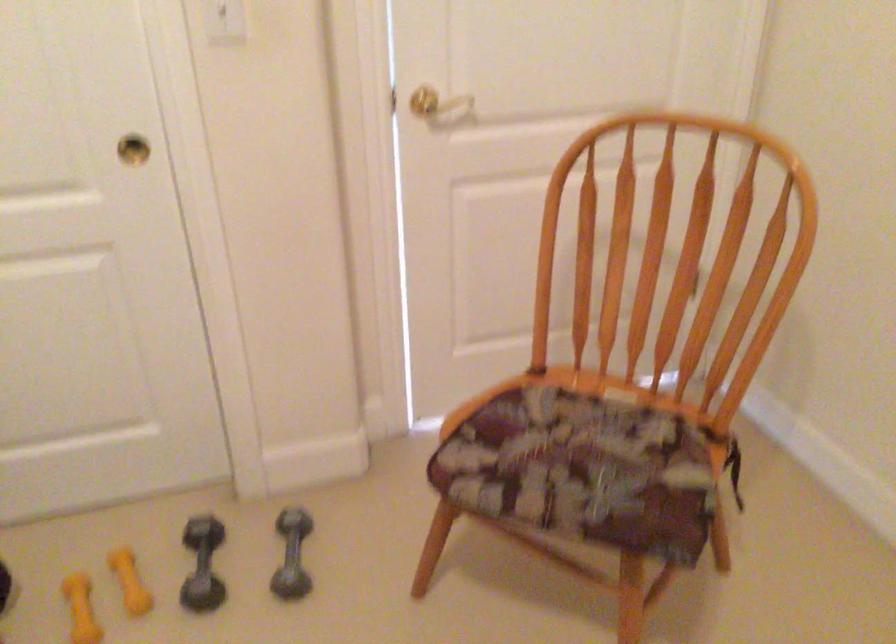
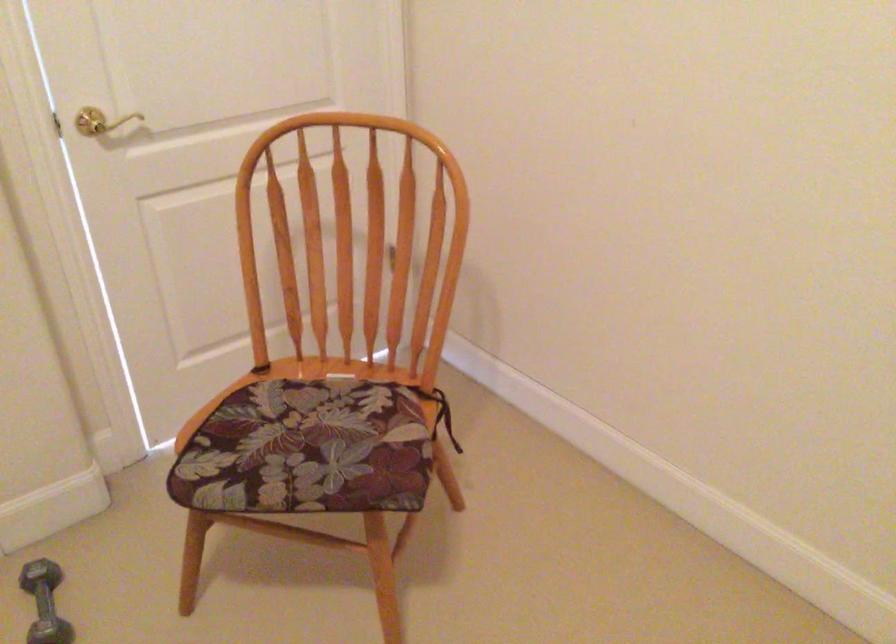
Question: The images are taken continuously from a first-person perspective. In which direction is your viewpoint rotating?

Choices:
 (A) Left
 (B) Right
 (C) Up
 (D) Down

Answer: (B)